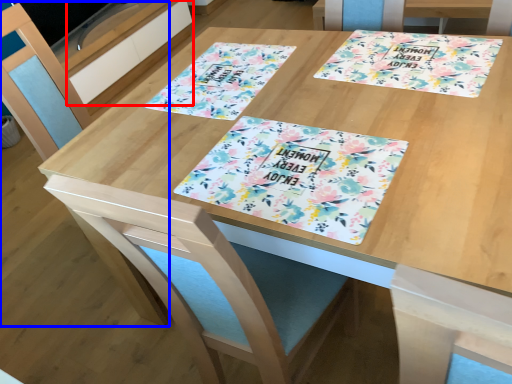
Question: Which point is further to the camera, drawer (highlighted by a red box) or chair (highlighted by a blue box)?

Choices:
 (A) drawer
 (B) chair

Answer: (A)